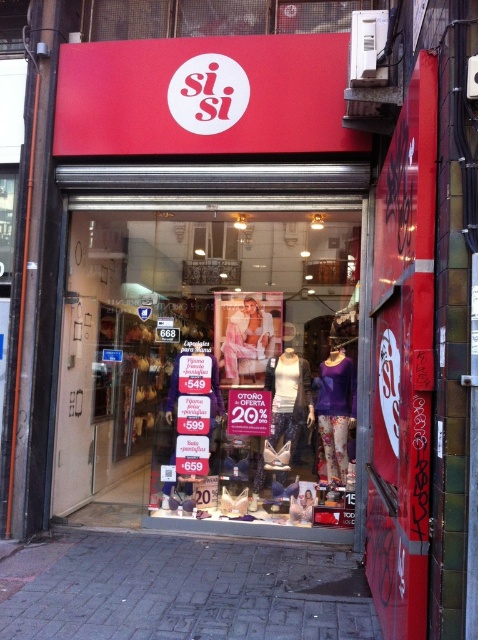
Question: Does transparent glass at center appear on the left side of purple matte sweater at center?

Choices:
 (A) yes
 (B) no

Answer: (A)

Question: Is transparent glass at center smaller than purple matte sweater at center?

Choices:
 (A) no
 (B) yes

Answer: (A)

Question: Among these points, which one is farthest from the camera?

Choices:
 (A) (286, 506)
 (B) (317, 404)

Answer: (A)

Question: Can you confirm if transparent glass at center is thinner than purple matte sweater at center?

Choices:
 (A) yes
 (B) no

Answer: (B)